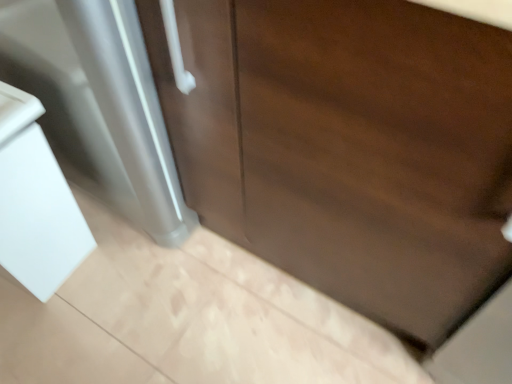
Where is `dark wood door at center`? dark wood door at center is located at coordinates (348, 146).

What do you see at coordinates (348, 146) in the screenshot? I see `dark wood door at center` at bounding box center [348, 146].

What do you see at coordinates (35, 202) in the screenshot? This screenshot has height=384, width=512. I see `white glossy sink at lower left` at bounding box center [35, 202].

Image resolution: width=512 pixels, height=384 pixels. What are the coordinates of `white glossy sink at lower left` in the screenshot? It's located at (35, 202).

Measure the distance between white glossy sink at lower left and camera.

The distance of white glossy sink at lower left from camera is 85.99 centimeters.

Where is `dark wood door at center`? This screenshot has height=384, width=512. dark wood door at center is located at coordinates (348, 146).

Which object is positioned more to the right, white glossy sink at lower left or dark wood door at center?

From the viewer's perspective, dark wood door at center appears more on the right side.

Based on the photo, in the image, is white glossy sink at lower left positioned in front of or behind dark wood door at center?

Visually, white glossy sink at lower left is located behind dark wood door at center.

Between point (28, 143) and point (334, 281), which one is positioned in front?

The point (28, 143) is closer to the camera.

From the image's perspective, which one is positioned lower, white glossy sink at lower left or dark wood door at center?

white glossy sink at lower left, from the image's perspective.

From a real-world perspective, relative to dark wood door at center, is white glossy sink at lower left vertically above or below?

white glossy sink at lower left is situated lower than dark wood door at center in the real world.

Considering the sizes of white glossy sink at lower left and dark wood door at center in the image, is white glossy sink at lower left wider or thinner than dark wood door at center?

Clearly, white glossy sink at lower left has less width compared to dark wood door at center.

Who is shorter, white glossy sink at lower left or dark wood door at center?

white glossy sink at lower left.

Between white glossy sink at lower left and dark wood door at center, which one has smaller size?

With smaller size is white glossy sink at lower left.

Would you say dark wood door at center is part of white glossy sink at lower left's contents?

No, dark wood door at center is located outside of white glossy sink at lower left.

Is white glossy sink at lower left not close to dark wood door at center?

That's not correct — white glossy sink at lower left is a little close to dark wood door at center.

Is dark wood door at center at the back of white glossy sink at lower left?

No, white glossy sink at lower left is not facing away from dark wood door at center.

This screenshot has width=512, height=384. In order to click on door above the white glossy sink at lower left (from a real-world perspective) in this screenshot , I will do `click(348, 146)`.

Is dark wood door at center at the right side of white glossy sink at lower left?

Yes.

In the image, is dark wood door at center positioned in front of or behind white glossy sink at lower left?

dark wood door at center is in front of white glossy sink at lower left.

From the picture: Which is less distant, (259, 9) or (56, 235)?

Point (259, 9)

From the image's perspective, would you say dark wood door at center is positioned over white glossy sink at lower left?

Yes, from the image's perspective, dark wood door at center is on top of white glossy sink at lower left.

From a real-world perspective, is dark wood door at center under white glossy sink at lower left?

Actually, dark wood door at center is physically above white glossy sink at lower left in the real world.

Which object is thinner, dark wood door at center or white glossy sink at lower left?

white glossy sink at lower left is thinner.

Between dark wood door at center and white glossy sink at lower left, which one has more height?

With more height is dark wood door at center.

Considering the relative sizes of dark wood door at center and white glossy sink at lower left in the image provided, is dark wood door at center smaller than white glossy sink at lower left?

Incorrect, dark wood door at center is not smaller in size than white glossy sink at lower left.

Is dark wood door at center surrounding white glossy sink at lower left?

Definitely not — white glossy sink at lower left is not inside dark wood door at center.

Are dark wood door at center and white glossy sink at lower left beside each other?

No, dark wood door at center is not in contact with white glossy sink at lower left.

Is dark wood door at center facing away from white glossy sink at lower left?

dark wood door at center is not turned away from white glossy sink at lower left.

Locate an element on the screen. door lying in front of the white glossy sink at lower left is located at coordinates (348, 146).

Identify the location of sink that is behind the dark wood door at center. (35, 202).

Identify the location of sink below the dark wood door at center (from a real-world perspective). This screenshot has width=512, height=384. (35, 202).